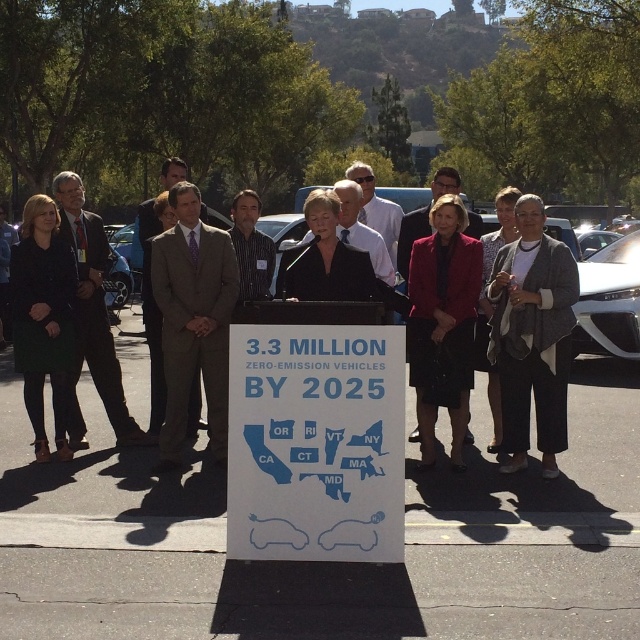
You are attending an outdoor event where a group is gathered around a podium. The podium has a sign stating a goal of 3.3 million zero emission vehicles by 2025 and a map of the northeastern US. You notice a point at coordinates (422, 218) on the image. What object does this point indicate?

The point at coordinates (422, 218) indicates a matte black suit at center.

You are standing at the podium in the image and want to walk to the white asphalt at center. What direction should you go?

You should walk towards the center of the image, where the white asphalt at center is located at point coordinates of (326,563).

You are attending an outdoor event and see two people wearing different clothing items. The dark suit at left and the white shirt at center. Which person is closer to you based on their clothing size?

The dark suit at left is smaller than the white shirt at center, so the person wearing the dark suit at left is farther away, meaning the white shirt at center is closer to you.